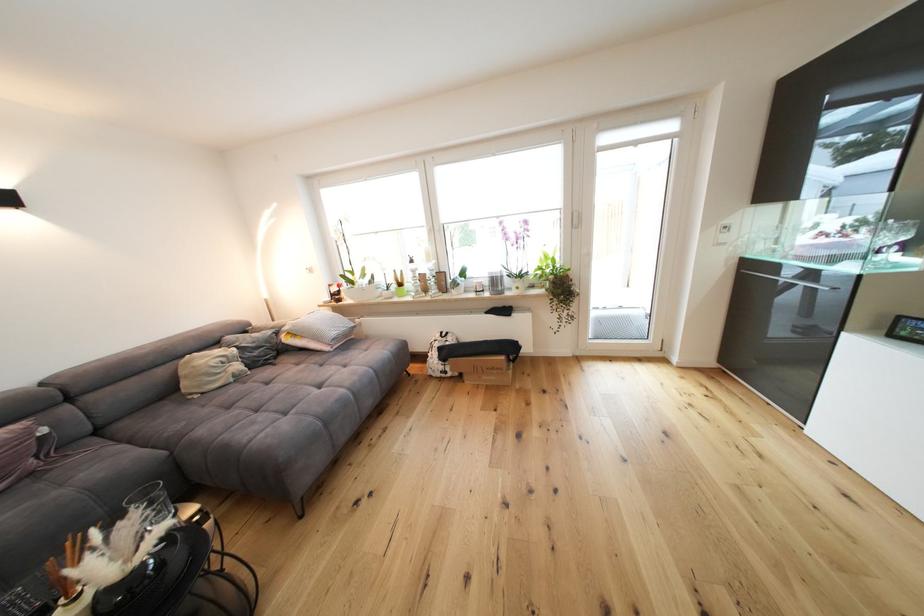
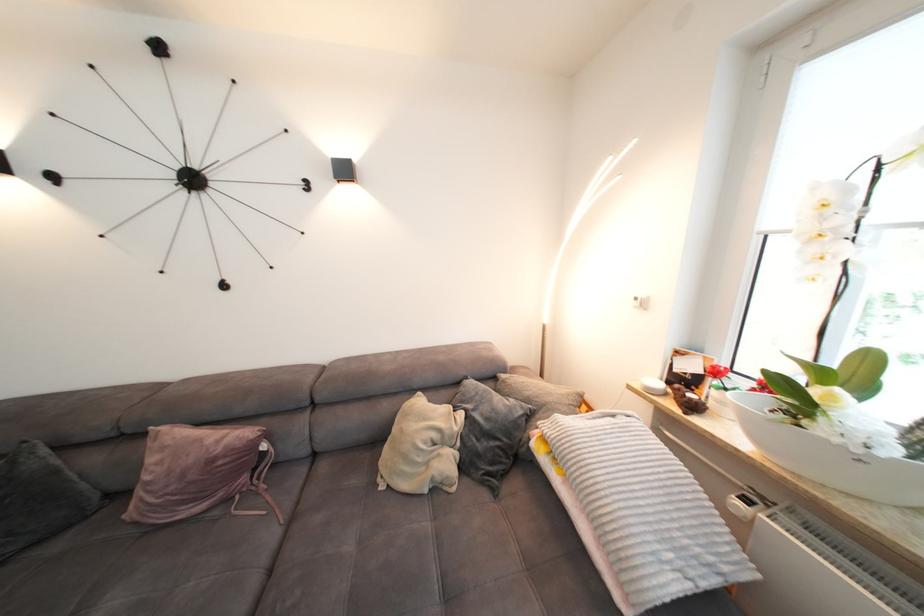
Where in the second image is the point corresponding to point 310,339 from the first image?

(574, 480)